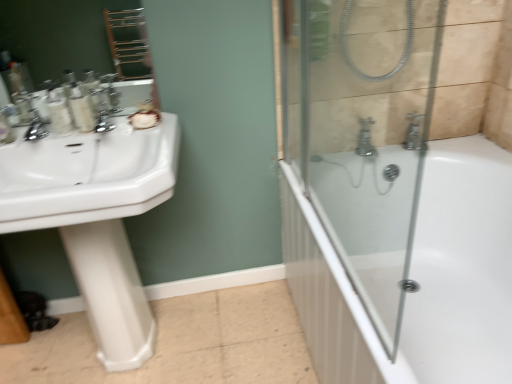
Locate an element on the screen. This screenshot has height=384, width=512. vacant space situated on the left part of white glossy pedestal at left is located at coordinates (73, 350).